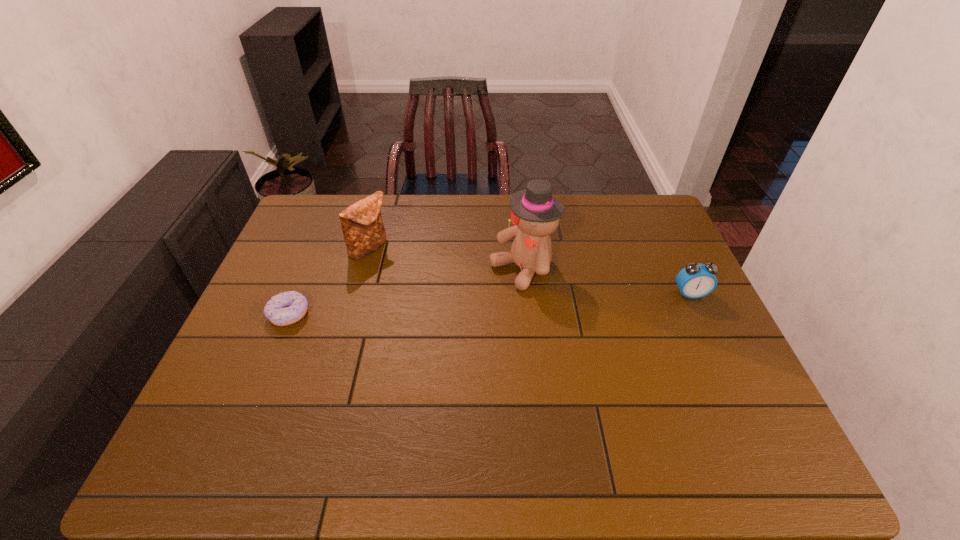
Image resolution: width=960 pixels, height=540 pixels. Identify the location of vacant spot on the desktop that is between the nearest object and the alarm clock and is positioned on the open side of the clutch bag. (443, 307).

This screenshot has width=960, height=540. What are the coordinates of `free space on the desktop that is between the doughnut and the alarm clock and is positioned on the front-facing side of the rag_doll` in the screenshot? It's located at (464, 306).